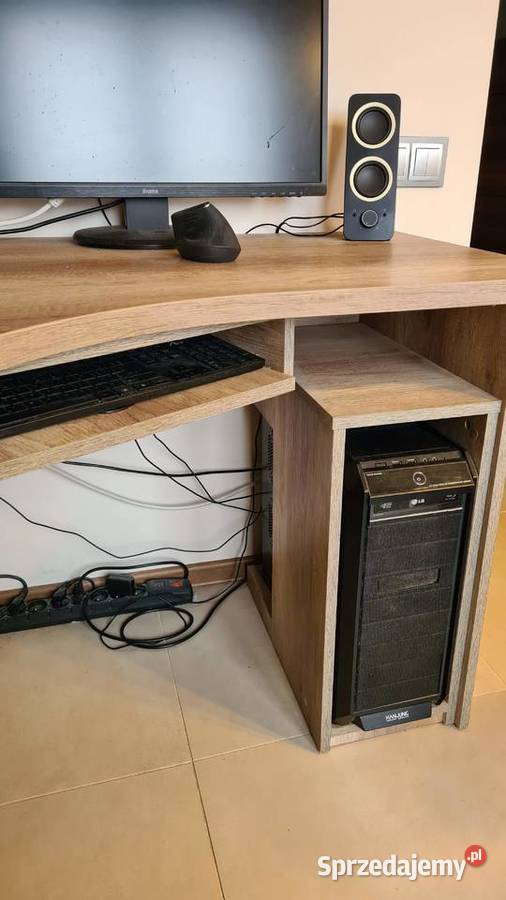
Where is `wood desk`? wood desk is located at coordinates (275, 281).